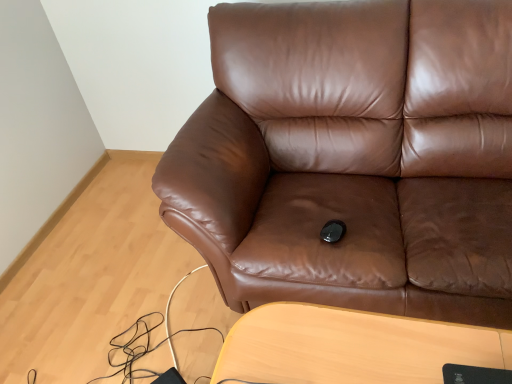
This screenshot has height=384, width=512. What do you see at coordinates (354, 158) in the screenshot?
I see `brown leather couch at center` at bounding box center [354, 158].

This screenshot has height=384, width=512. In order to click on brown leather couch at center in this screenshot , I will do pos(354,158).

You are a GUI agent. You are given a task and a screenshot of the screen. Output one action in this format:
    pyautogui.click(x=<x>, y=<y>)
    Task: Click on the brown leather couch at center
    The width and height of the screenshot is (512, 384).
    Given the screenshot: What is the action you would take?
    pyautogui.click(x=354, y=158)